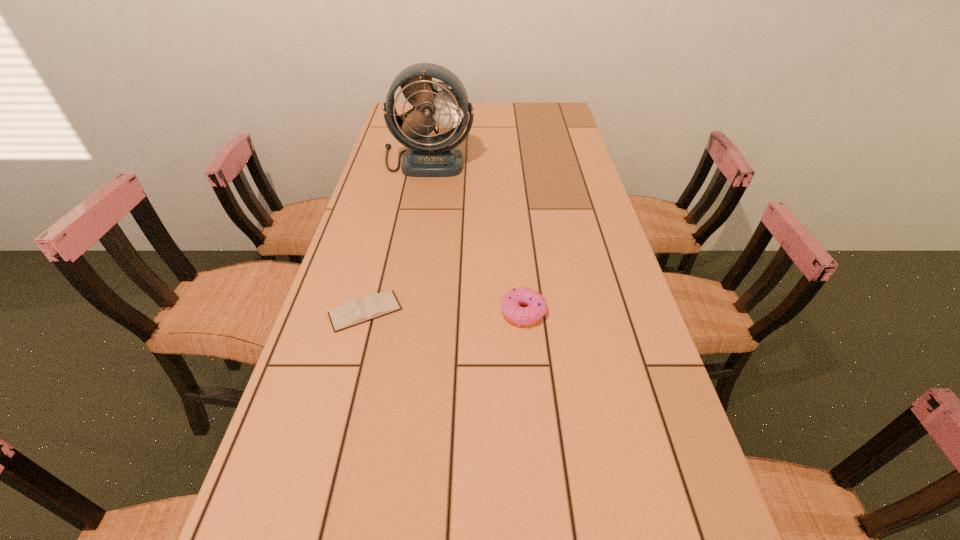
You are a GUI agent. You are given a task and a screenshot of the screen. Output one action in this format:
    pyautogui.click(x=<x>, y=<y>)
    Task: Click on the tallest object
    
    Given the screenshot: What is the action you would take?
    coord(427,156)

In order to click on the second farthest object in this screenshot , I will do `click(427, 156)`.

Find the location of a particular element. Image resolution: width=960 pixels, height=540 pixels. the second tallest object is located at coordinates (442, 83).

Locate an element on the screen. The width and height of the screenshot is (960, 540). can is located at coordinates (442, 83).

The width and height of the screenshot is (960, 540). Find the location of `doughnut`. doughnut is located at coordinates (536, 304).

This screenshot has width=960, height=540. What are the coordinates of `the rightmost object` in the screenshot? It's located at (536, 304).

I want to click on diary, so click(x=372, y=306).

What are the coordinates of `free space located 0.210m in front of the fan to blow air` in the screenshot? It's located at (419, 214).

Where is `vacant area situated on the back of the farthest object`? This screenshot has width=960, height=540. vacant area situated on the back of the farthest object is located at coordinates (442, 104).

Locate an element on the screen. This screenshot has width=960, height=540. vacant space located on the back of the rightmost object is located at coordinates (513, 205).